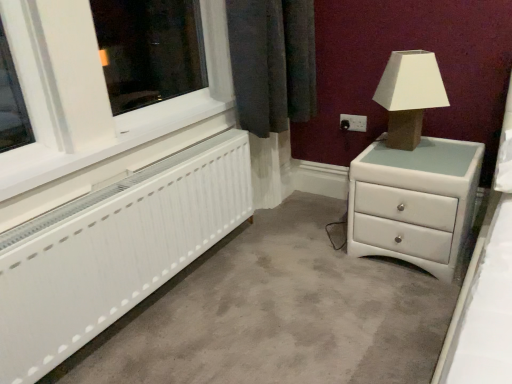
Question: From a real-world perspective, is white glossy chest of drawers at right located higher than white plastic window frame at left?

Choices:
 (A) yes
 (B) no

Answer: (B)

Question: Can you confirm if white glossy chest of drawers at right is smaller than white plastic window frame at left?

Choices:
 (A) no
 (B) yes

Answer: (A)

Question: Is the position of white glossy chest of drawers at right less distant than that of white plastic window frame at left?

Choices:
 (A) yes
 (B) no

Answer: (B)

Question: Does white glossy chest of drawers at right have a larger size compared to white plastic window frame at left?

Choices:
 (A) no
 (B) yes

Answer: (B)

Question: Does white glossy chest of drawers at right contain white plastic window frame at left?

Choices:
 (A) yes
 (B) no

Answer: (B)

Question: Relative to black plastic electric outlet at upper right, is white matte radiator at lower left in front or behind?

Choices:
 (A) front
 (B) behind

Answer: (A)

Question: Considering the positions of white matte radiator at lower left and black plastic electric outlet at upper right in the image, is white matte radiator at lower left taller or shorter than black plastic electric outlet at upper right?

Choices:
 (A) short
 (B) tall

Answer: (B)

Question: In terms of width, does white matte radiator at lower left look wider or thinner when compared to black plastic electric outlet at upper right?

Choices:
 (A) wide
 (B) thin

Answer: (A)

Question: Is point (117, 235) positioned closer to the camera than point (345, 125)?

Choices:
 (A) farther
 (B) closer

Answer: (B)

Question: Based on their positions, is matte brown table lamp at upper right located to the left or right of white plastic window frame at left?

Choices:
 (A) right
 (B) left

Answer: (A)

Question: Considering the positions of matte brown table lamp at upper right and white plastic window frame at left in the image, is matte brown table lamp at upper right bigger or smaller than white plastic window frame at left?

Choices:
 (A) big
 (B) small

Answer: (A)

Question: Relative to white plastic window frame at left, is matte brown table lamp at upper right in front or behind?

Choices:
 (A) front
 (B) behind

Answer: (B)

Question: From the image's perspective, is matte brown table lamp at upper right above or below white plastic window frame at left?

Choices:
 (A) above
 (B) below

Answer: (A)

Question: From the image's perspective, is white plastic window frame at left positioned above or below white glossy chest of drawers at right?

Choices:
 (A) below
 (B) above

Answer: (B)

Question: From a real-world perspective, is white plastic window frame at left above or below white glossy chest of drawers at right?

Choices:
 (A) below
 (B) above

Answer: (B)